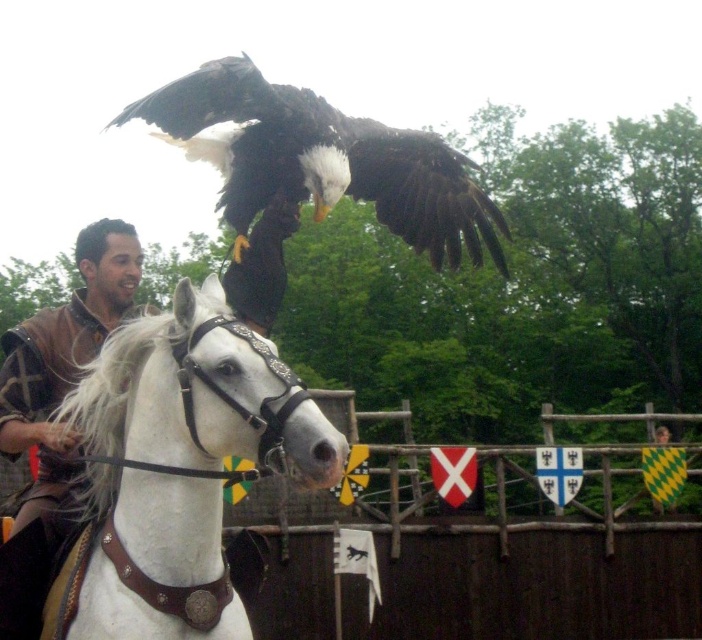
Does white leather horse at center have a lesser width compared to brown leather armor at left?

Correct, white leather horse at center's width is less than brown leather armor at left's.

Between point (99, 464) and point (15, 513), which one is positioned behind?

The point (15, 513) is more distant.

Which is behind, point (168, 556) or point (53, 445)?

The point (53, 445) is behind.

This screenshot has width=702, height=640. Find the location of `white leather horse at center`. white leather horse at center is located at coordinates (164, 480).

Between point (185, 500) and point (183, 86), which one is positioned in front?

Point (185, 500) is in front.

Who is positioned more to the left, white leather horse at center or dark brown feathers at center?

From the viewer's perspective, white leather horse at center appears more on the left side.

Which is in front, point (98, 362) or point (300, 195)?

Point (98, 362) is more forward.

Identify the location of white leather horse at center. (164, 480).

Can you confirm if dark brown feathers at center is positioned to the right of brown leather armor at left?

Indeed, dark brown feathers at center is positioned on the right side of brown leather armor at left.

Describe the element at coordinates (322, 160) in the screenshot. I see `dark brown feathers at center` at that location.

You are a GUI agent. You are given a task and a screenshot of the screen. Output one action in this format:
    pyautogui.click(x=<x>, y=<y>)
    Task: Click on the dark brown feathers at center
    
    Given the screenshot: What is the action you would take?
    (322, 160)